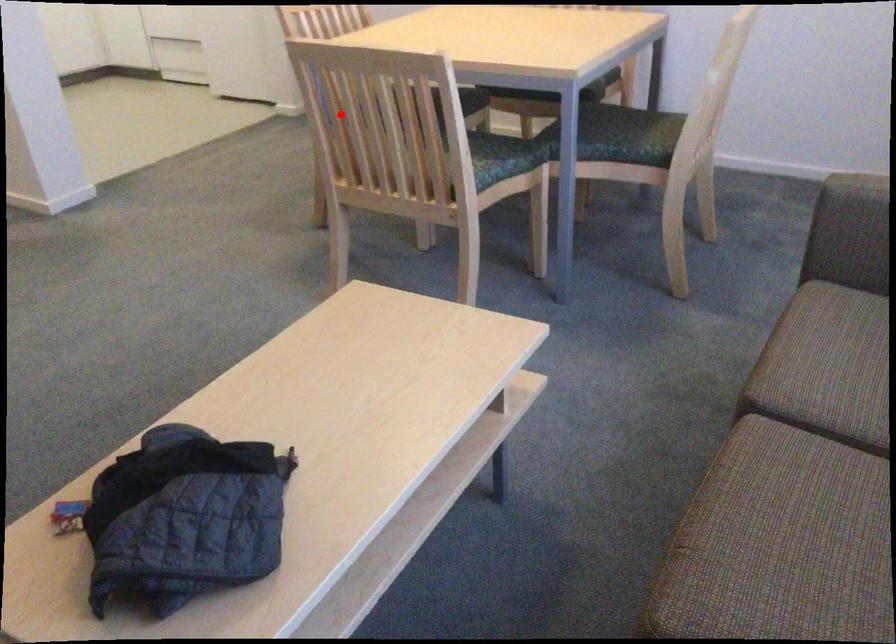
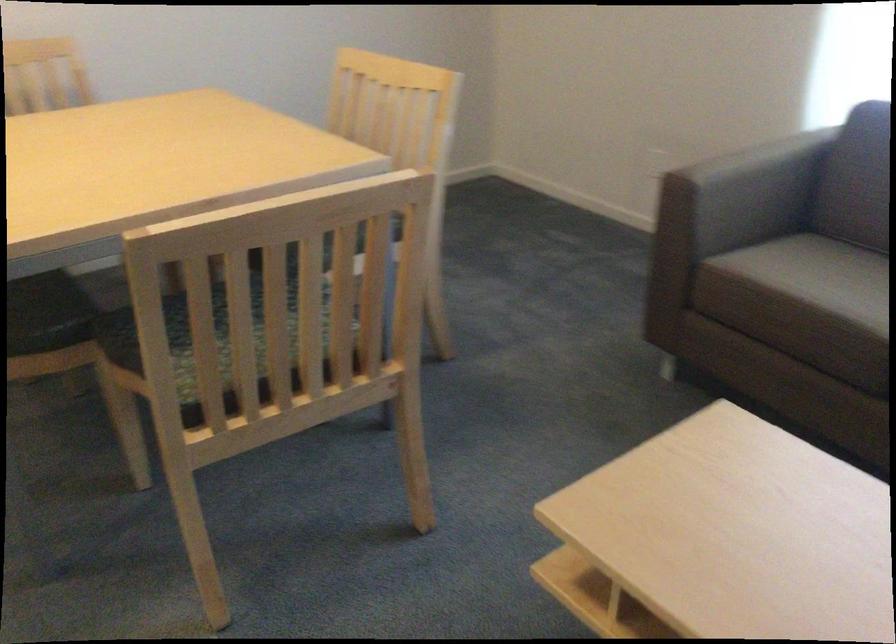
In the second image, find the point that corresponds to the highlighted location in the first image.

(211, 334)